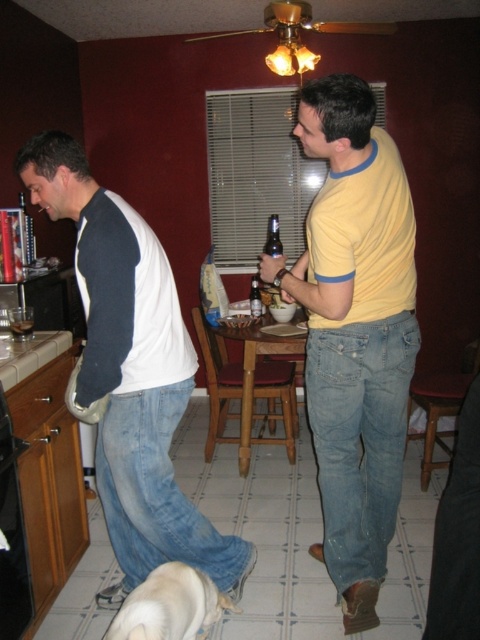
Question: In this image, where is white cotton shirt at left located relative to matte glass beer bottle at center?

Choices:
 (A) below
 (B) above

Answer: (A)

Question: Which of the following is the farthest from the observer?

Choices:
 (A) (133, 262)
 (B) (288, 285)
 (C) (20, 336)

Answer: (C)

Question: Among these objects, which one is farthest from the camera?

Choices:
 (A) matte plastic cup at lower left
 (B) white fur dog at lower center
 (C) matte glass beer bottle at center

Answer: (C)

Question: Is matte plastic cup at lower left behind matte glass beer bottle at center?

Choices:
 (A) yes
 (B) no

Answer: (B)

Question: Which is nearer to the matte glass beer bottle at center?

Choices:
 (A) matte plastic cup at lower left
 (B) yellow matte shirt at center

Answer: (A)

Question: Is white fur dog at lower center in front of matte plastic cup at lower left?

Choices:
 (A) yes
 (B) no

Answer: (A)